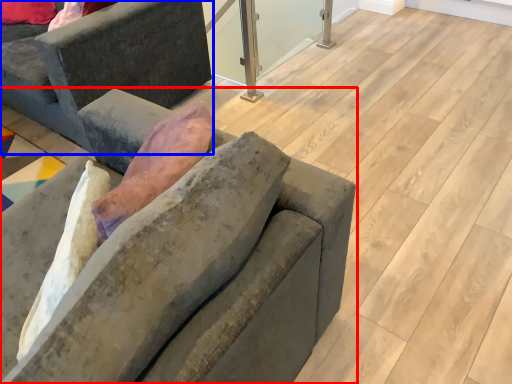
Question: Among these objects, which one is farthest to the camera, studio couch (highlighted by a red box) or studio couch (highlighted by a blue box)?

Choices:
 (A) studio couch
 (B) studio couch

Answer: (B)